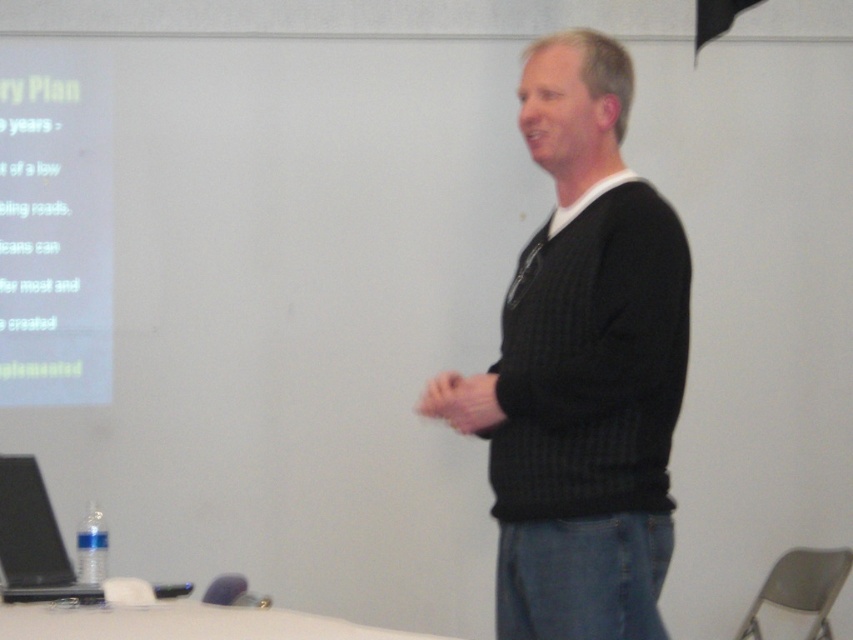
The man is standing in front of a projection screen. There is a point at coordinates (54,227). What object is located at that point?

The point at coordinates (54,227) corresponds to the white paper at upper left.

You are a presenter who needs to reach both the white paper at upper left and the black matte laptop at lower left during your talk. If you start from the center of the room, which object would you need to walk towards first to reach the closer one?

The white paper at upper left is closer to the center of the room than the black matte laptop at lower left, so you should walk towards the white paper at upper left first.

You are a photographer setting up for a presentation. You need to focus your camera on the black knitted sweater at center and the black matte laptop at lower left. Which object should you adjust the focus distance for first if you want to ensure both are in focus?

The black knitted sweater at center is closer to the viewer than the black matte laptop at lower left. To ensure both are in focus, you should first adjust the focus distance for the black knitted sweater at center since it is closer, allowing the camera to set the focal plane appropriately before adjusting for the farther object.